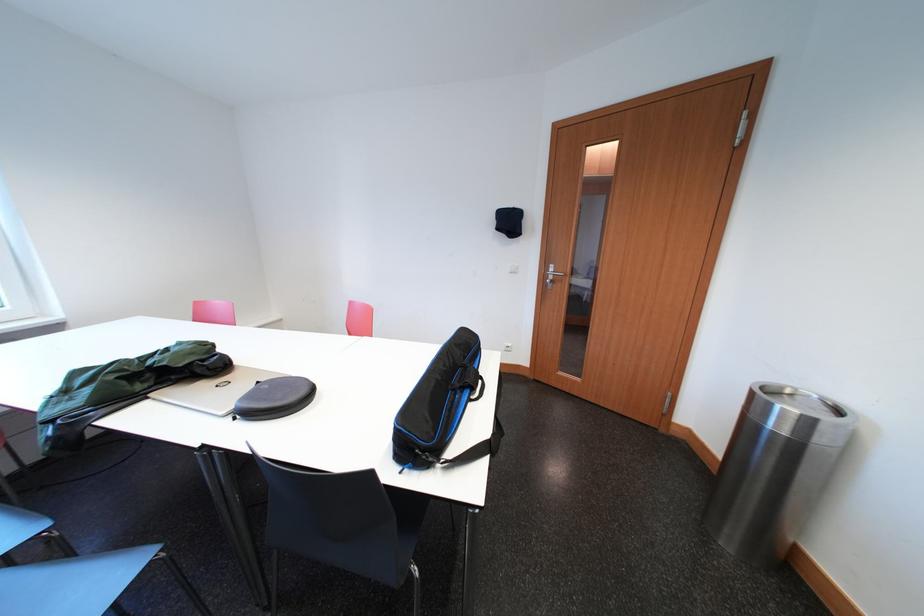
Locate an element on the screen. Image resolution: width=924 pixels, height=616 pixels. silver door handle is located at coordinates (x=551, y=276).